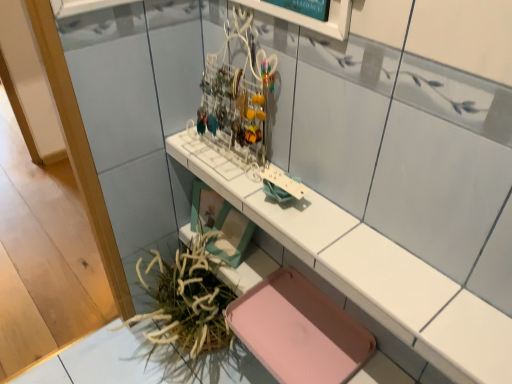
Question: Is white glossy counter at center beside pink matte tray at lower center?

Choices:
 (A) no
 (B) yes

Answer: (A)

Question: Is white glossy counter at center bigger than pink matte tray at lower center?

Choices:
 (A) yes
 (B) no

Answer: (A)

Question: Is white glossy counter at center wider than pink matte tray at lower center?

Choices:
 (A) yes
 (B) no

Answer: (B)

Question: Can you confirm if white glossy counter at center is positioned to the left of pink matte tray at lower center?

Choices:
 (A) yes
 (B) no

Answer: (A)

Question: From the image's perspective, is white glossy counter at center beneath pink matte tray at lower center?

Choices:
 (A) no
 (B) yes

Answer: (A)

Question: Considering the positions of white glossy counter at center and pink matte tray at lower center in the image, is white glossy counter at center wider or thinner than pink matte tray at lower center?

Choices:
 (A) thin
 (B) wide

Answer: (A)

Question: From a real-world perspective, relative to pink matte tray at lower center, is white glossy counter at center vertically above or below?

Choices:
 (A) above
 (B) below

Answer: (A)

Question: Is point (413, 311) positioned closer to the camera than point (358, 359)?

Choices:
 (A) closer
 (B) farther

Answer: (A)

Question: Is white glossy counter at center inside or outside of pink matte tray at lower center?

Choices:
 (A) outside
 (B) inside

Answer: (A)

Question: In terms of height, does green leafy plant at lower left look taller or shorter compared to white glossy counter at center?

Choices:
 (A) short
 (B) tall

Answer: (B)

Question: In terms of size, does green leafy plant at lower left appear bigger or smaller than white glossy counter at center?

Choices:
 (A) small
 (B) big

Answer: (B)

Question: From a real-world perspective, is green leafy plant at lower left positioned above or below white glossy counter at center?

Choices:
 (A) above
 (B) below

Answer: (B)

Question: From the image's perspective, is green leafy plant at lower left positioned above or below white glossy counter at center?

Choices:
 (A) above
 (B) below

Answer: (B)

Question: From a real-world perspective, is pink matte tray at lower center above or below white glossy counter at center?

Choices:
 (A) above
 (B) below

Answer: (B)

Question: Considering the positions of point (330, 309) and point (415, 281), is point (330, 309) closer or farther from the camera than point (415, 281)?

Choices:
 (A) farther
 (B) closer

Answer: (A)